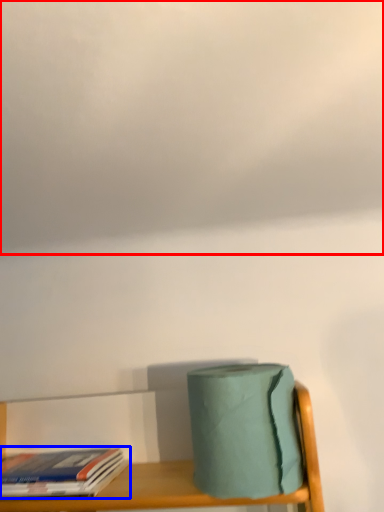
Question: Which object appears closest to the camera in this image, cloud (highlighted by a red box) or book (highlighted by a blue box)?

Choices:
 (A) cloud
 (B) book

Answer: (A)